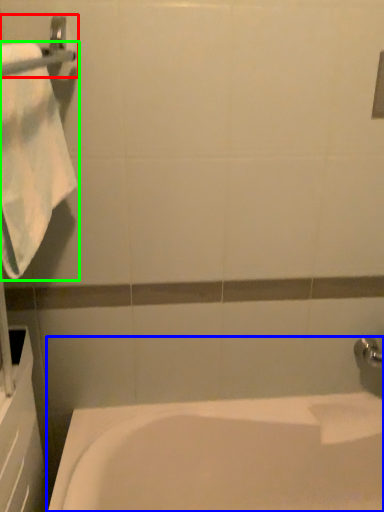
Question: Estimate the real-world distances between objects in this image. Which object is closer to towel bar (highlighted by a red box), bathtub (highlighted by a blue box) or towel (highlighted by a green box)?

Choices:
 (A) bathtub
 (B) towel

Answer: (B)